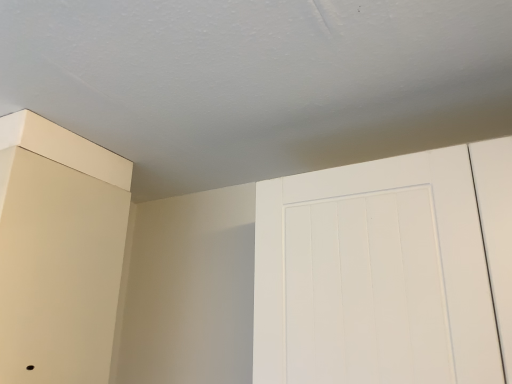
Measure the distance between point [85,318] and camera.

3.60 feet.

You are a GUI agent. You are given a task and a screenshot of the screen. Output one action in this format:
    pyautogui.click(x=<x>, y=<y>)
    Task: Click on the matte cream door at left
    This screenshot has width=512, height=384.
    Given the screenshot: What is the action you would take?
    pyautogui.click(x=59, y=251)

Measure the distance between matte cream door at left and camera.

The distance of matte cream door at left from camera is 35.16 inches.

Describe the element at coordinates (59, 251) in the screenshot. The image size is (512, 384). I see `matte cream door at left` at that location.

What is the approximate width of matte cream door at left?

It is 12.23 inches.

Find the location of a particular element. The width and height of the screenshot is (512, 384). matte cream door at left is located at coordinates (59, 251).